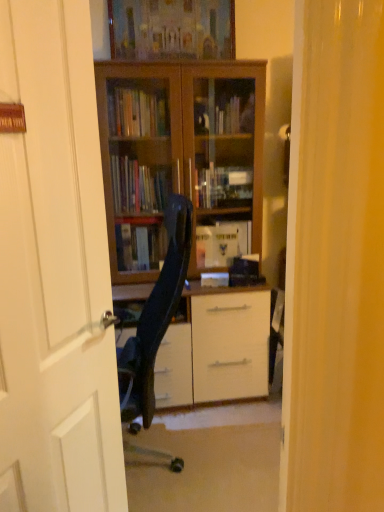
Question: From the image's perspective, is wooden picture frame at upper center above white wooden door at center?

Choices:
 (A) no
 (B) yes

Answer: (B)

Question: Is wooden picture frame at upper center not close to white wooden door at center?

Choices:
 (A) no
 (B) yes

Answer: (B)

Question: From a real-world perspective, is wooden picture frame at upper center on top of white wooden door at center?

Choices:
 (A) no
 (B) yes

Answer: (B)

Question: From a real-world perspective, is wooden picture frame at upper center positioned under white wooden door at center based on gravity?

Choices:
 (A) yes
 (B) no

Answer: (B)

Question: Is wooden picture frame at upper center aimed at white wooden door at center?

Choices:
 (A) yes
 (B) no

Answer: (B)

Question: Considering the relative positions of wooden picture frame at upper center and white wooden door at center in the image provided, is wooden picture frame at upper center to the left or to the right of white wooden door at center?

Choices:
 (A) right
 (B) left

Answer: (A)

Question: Is wooden picture frame at upper center bigger or smaller than white wooden door at center?

Choices:
 (A) big
 (B) small

Answer: (B)

Question: Relative to white wooden door at center, is wooden picture frame at upper center in front or behind?

Choices:
 (A) behind
 (B) front

Answer: (A)

Question: From the image's perspective, relative to white wooden door at center, is wooden picture frame at upper center above or below?

Choices:
 (A) below
 (B) above

Answer: (B)

Question: Choose the correct answer: Is wooden bookcase at center inside white wooden door at center or outside it?

Choices:
 (A) outside
 (B) inside

Answer: (A)

Question: Relative to white wooden door at center, is wooden bookcase at center in front or behind?

Choices:
 (A) front
 (B) behind

Answer: (B)

Question: Considering the positions of wooden bookcase at center and white wooden door at center in the image, is wooden bookcase at center wider or thinner than white wooden door at center?

Choices:
 (A) thin
 (B) wide

Answer: (B)

Question: Is point (152, 251) positioned closer to the camera than point (49, 75)?

Choices:
 (A) closer
 (B) farther

Answer: (B)

Question: Is wooden bookcase at center inside the boundaries of wooden picture frame at upper center, or outside?

Choices:
 (A) outside
 (B) inside

Answer: (A)

Question: From a real-world perspective, relative to wooden picture frame at upper center, is wooden bookcase at center vertically above or below?

Choices:
 (A) below
 (B) above

Answer: (A)